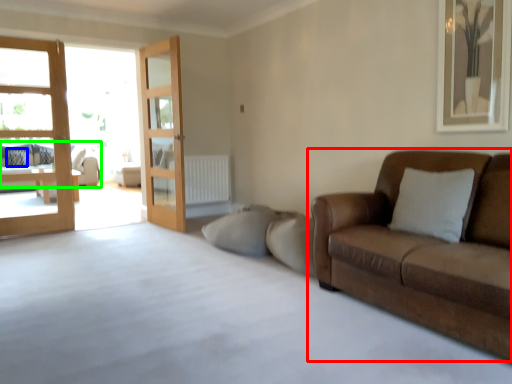
Question: Based on their relative distances, which object is nearer to studio couch (highlighted by a red box)? Choose from pillow (highlighted by a blue box) and studio couch (highlighted by a green box).

Choices:
 (A) pillow
 (B) studio couch

Answer: (A)